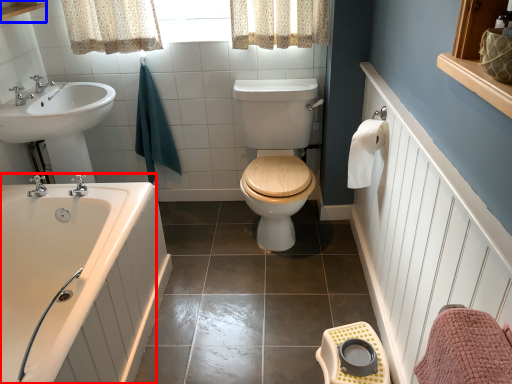
Question: Which of the following is the farthest to the observer, bathtub (highlighted by a red box) or balustrade (highlighted by a blue box)?

Choices:
 (A) bathtub
 (B) balustrade

Answer: (B)